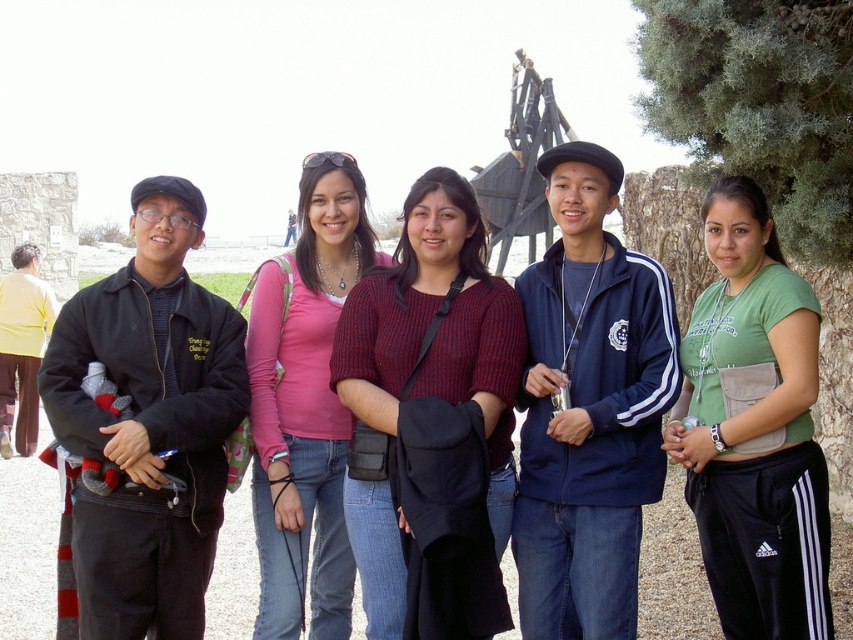
Is knitted maroon sweater at center positioned at the back of blue track jacket at center?

No, knitted maroon sweater at center is closer to the viewer.

Who is positioned more to the right, knitted maroon sweater at center or blue track jacket at center?

From the viewer's perspective, blue track jacket at center appears more on the right side.

Does point (447, 369) come closer to viewer compared to point (590, 248)?

Yes, it is.

This screenshot has height=640, width=853. Find the location of `knitted maroon sweater at center`. knitted maroon sweater at center is located at coordinates (431, 420).

Can you confirm if black matte jacket at left is smaller than pink fabric shirt at center?

No, black matte jacket at left is not smaller than pink fabric shirt at center.

Does black matte jacket at left appear over pink fabric shirt at center?

No, black matte jacket at left is not above pink fabric shirt at center.

The height and width of the screenshot is (640, 853). I want to click on black matte jacket at left, so click(149, 422).

The image size is (853, 640). Identify the location of black matte jacket at left. (149, 422).

Which is above, knitted maroon sweater at center or pink fabric shirt at center?

knitted maroon sweater at center

Is knitted maroon sweater at center positioned before pink fabric shirt at center?

Yes, it is.

Does point (355, 525) come behind point (264, 428)?

No, it is in front of (264, 428).

Locate an element on the screen. knitted maroon sweater at center is located at coordinates [431, 420].